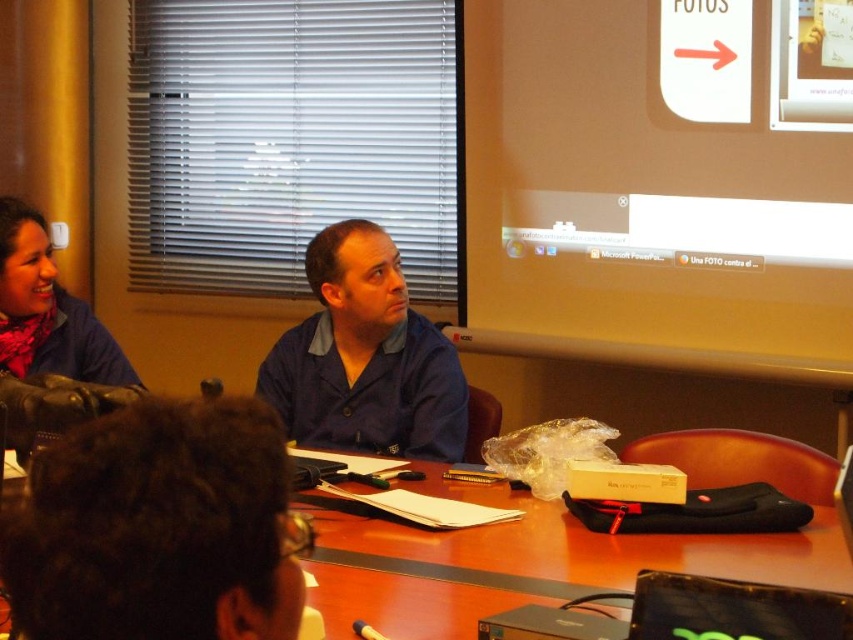
Based on the photo, can you confirm if brown wooden table at center is bigger than matte blue shirt at left?

Yes.

Is brown wooden table at center wider than matte blue shirt at left?

Yes, brown wooden table at center is wider than matte blue shirt at left.

Does point (318, 595) come in front of point (56, 282)?

Yes, it is.

Where is `brown wooden table at center`? brown wooden table at center is located at coordinates (566, 545).

Between white glossy projection screen at upper center and matte blue shirt at left, which one has more height?

white glossy projection screen at upper center

Who is lower down, white glossy projection screen at upper center or matte blue shirt at left?

matte blue shirt at left is below.

Is point (469, 250) closer to camera compared to point (16, 243)?

No, it is behind (16, 243).

You are a GUI agent. You are given a task and a screenshot of the screen. Output one action in this format:
    pyautogui.click(x=<x>, y=<y>)
    Task: Click on the white glossy projection screen at upper center
    The width and height of the screenshot is (853, 640).
    Given the screenshot: What is the action you would take?
    pyautogui.click(x=651, y=189)

Is dark brown hair at lower left further to the viewer compared to brown wooden table at center?

That is False.

Which of these two, dark brown hair at lower left or brown wooden table at center, stands shorter?

brown wooden table at center is shorter.

Is point (132, 632) in front of point (691, 484)?

Yes, it is in front of point (691, 484).

The height and width of the screenshot is (640, 853). What are the coordinates of `dark brown hair at lower left` in the screenshot? It's located at (160, 528).